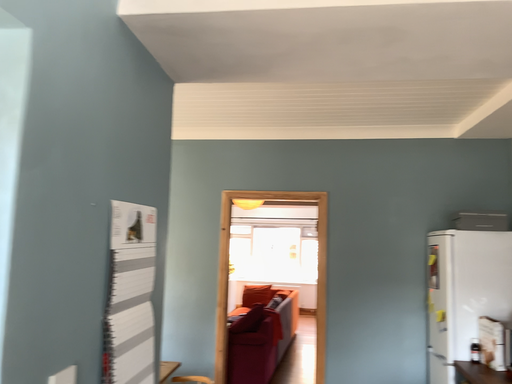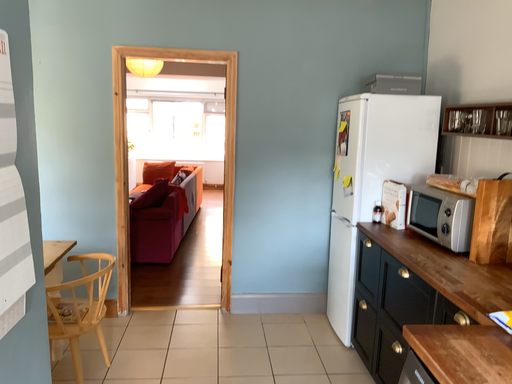
Question: How did the camera likely rotate when shooting the video?

Choices:
 (A) rotated upward
 (B) rotated downward

Answer: (B)